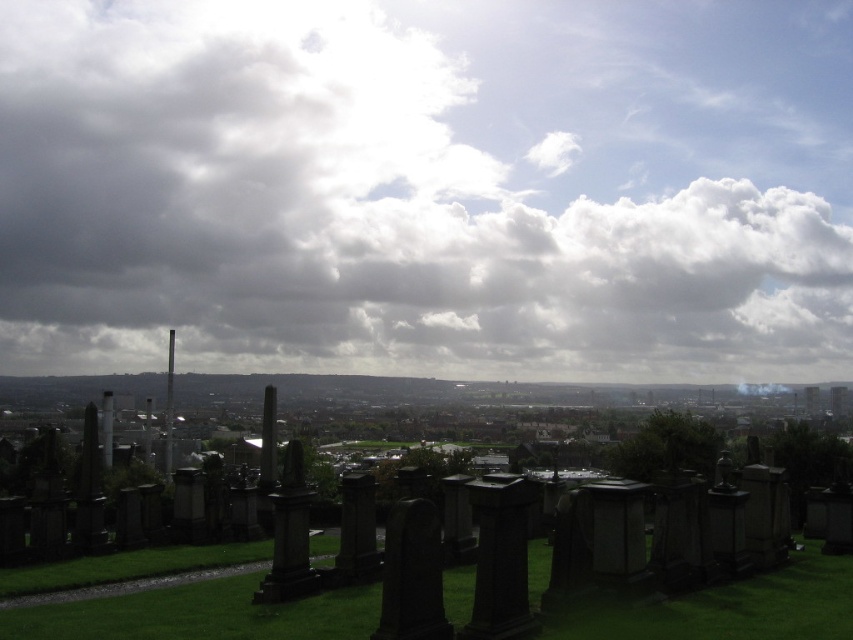
You are a maintenance worker tasked with mowing the lawn. You have a lawnmower that can cut grass up to 3 meters wide. You need to mow the area between the black stone gravestones at lower center and the green grassy at lower center. Can your lawnmower fit in that space?

The distance between the black stone gravestones at lower center and the green grassy at lower center is 3.62 meters. Since your lawnmower can only cut up to 3 meters wide, it is not wide enough to cover the entire 3.62 meters in one pass. You will need to make multiple passes or use a wider lawnmower.

As you stand in the cemetery looking out, you notice the cloudy sky at upper center and the green grassy at lower center. Which of these two elements occupies a bigger portion of your field of view?

The cloudy sky at upper center has a larger size compared to the green grassy at lower center, so it occupies a bigger portion of your field of view.